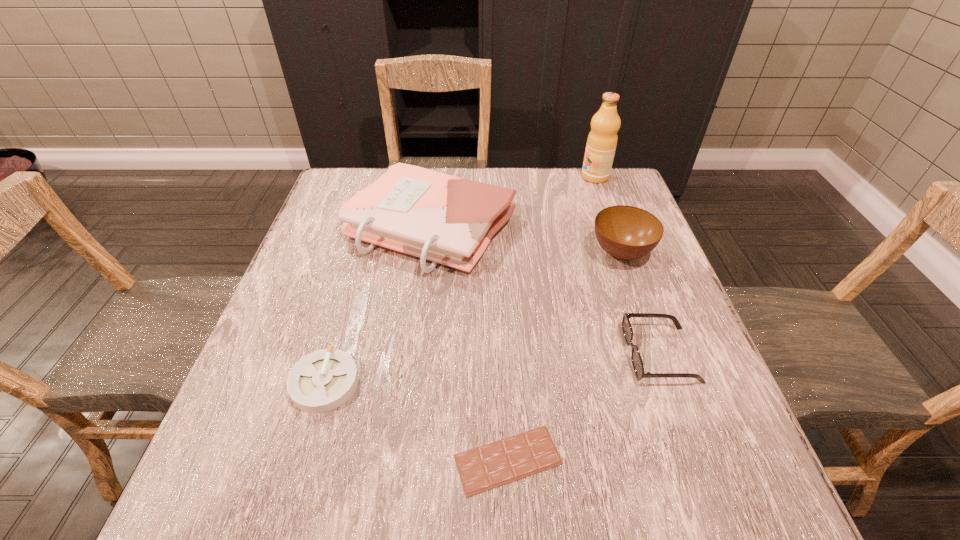
Where is `vacant space positioned on the front label of the tallest object`? vacant space positioned on the front label of the tallest object is located at coordinates (455, 177).

Where is `free point located 0.330m on the right of the phonebook`? free point located 0.330m on the right of the phonebook is located at coordinates (643, 227).

The image size is (960, 540). Find the location of `vacant space located on the left of the bowl`. vacant space located on the left of the bowl is located at coordinates (536, 253).

Identify the location of free location located 0.170m on the front-facing side of the sunglasses. The height and width of the screenshot is (540, 960). (539, 354).

Find the location of `vacant space positioned 0.070m on the front-facing side of the sunglasses`. vacant space positioned 0.070m on the front-facing side of the sunglasses is located at coordinates (590, 354).

Where is `vacant space situated on the front-facing side of the sunglasses`? vacant space situated on the front-facing side of the sunglasses is located at coordinates (528, 354).

Find the location of a particular element. The image size is (960, 540). free space located 0.060m on the left of the ashtray is located at coordinates (259, 383).

Identify the location of free location located on the left of the chocolate bar. This screenshot has height=540, width=960. (261, 460).

This screenshot has height=540, width=960. I want to click on fruit juice that is positioned at the far edge, so click(602, 140).

The height and width of the screenshot is (540, 960). Identify the location of phonebook present at the far edge. (445, 219).